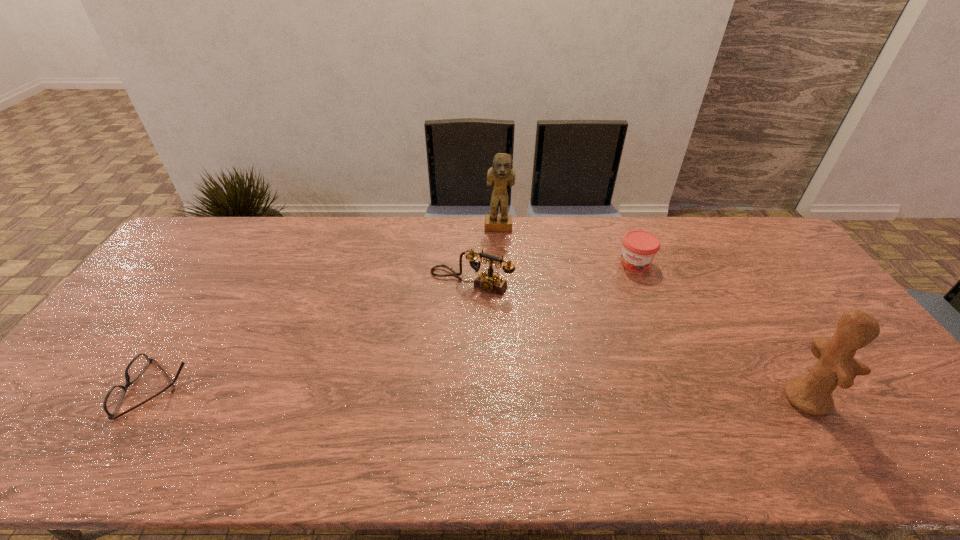
Image resolution: width=960 pixels, height=540 pixels. Find the location of `vacant space located 0.340m on the front-facing side of the third tallest object`. vacant space located 0.340m on the front-facing side of the third tallest object is located at coordinates (393, 380).

Locate an element on the screen. figurine that is at the far edge is located at coordinates (501, 174).

Locate an element on the screen. jam present at the far edge is located at coordinates (639, 248).

This screenshot has height=540, width=960. What are the coordinates of `spectacles located at the near edge` in the screenshot? It's located at (113, 399).

The width and height of the screenshot is (960, 540). Identify the location of figurine that is positioned at the near edge. (836, 366).

At what (x,y) coordinates should I click in order to perform the action: click on free spot at the far edge of the desktop. Please return your answer as a coordinate pair (x, y). This screenshot has width=960, height=540. Looking at the image, I should click on (353, 226).

Locate an element on the screen. vacant space at the near edge of the desktop is located at coordinates (841, 402).

In the image, there is a desktop. Identify the location of vacant space at the right edge. The width and height of the screenshot is (960, 540). (753, 263).

You are a GUI agent. You are given a task and a screenshot of the screen. Output one action in this format:
    pyautogui.click(x=<x>, y=<y>)
    Task: Click on the free space at the far left corner of the desktop
    
    Given the screenshot: What is the action you would take?
    pyautogui.click(x=186, y=247)

In the image, there is a desktop. Where is `vacant region at the far right corner`? Image resolution: width=960 pixels, height=540 pixels. vacant region at the far right corner is located at coordinates (763, 244).